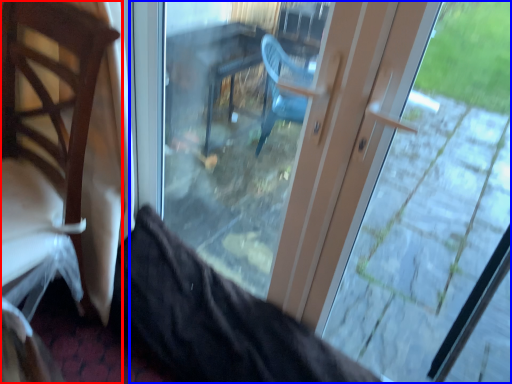
Question: Which object is closer to the camera taking this photo, chair (highlighted by a red box) or door (highlighted by a blue box)?

Choices:
 (A) chair
 (B) door

Answer: (B)